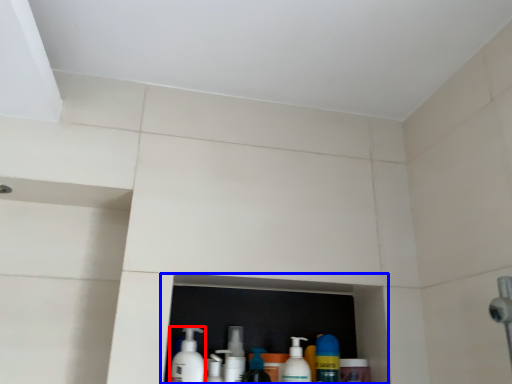
Question: Which object is closer to the camera taking this photo, cleaning product (highlighted by a red box) or shelf (highlighted by a blue box)?

Choices:
 (A) cleaning product
 (B) shelf

Answer: (A)